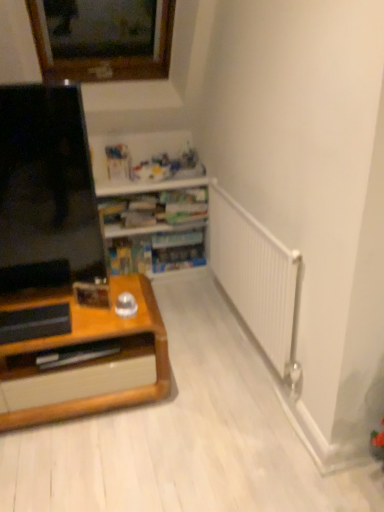
Question: From a real-world perspective, is wooden bookshelf at center positioned above or below black glossy screen at left?

Choices:
 (A) above
 (B) below

Answer: (B)

Question: In terms of size, does wooden bookshelf at center appear bigger or smaller than black glossy screen at left?

Choices:
 (A) big
 (B) small

Answer: (A)

Question: Choose the correct answer: Is wooden bookshelf at center inside black glossy screen at left or outside it?

Choices:
 (A) inside
 (B) outside

Answer: (B)

Question: From a real-world perspective, relative to wooden bookshelf at center, is black glossy screen at left vertically above or below?

Choices:
 (A) above
 (B) below

Answer: (A)

Question: Considering the positions of black glossy screen at left and wooden bookshelf at center in the image, is black glossy screen at left wider or thinner than wooden bookshelf at center?

Choices:
 (A) wide
 (B) thin

Answer: (B)

Question: In the image, is black glossy screen at left positioned in front of or behind wooden bookshelf at center?

Choices:
 (A) behind
 (B) front

Answer: (B)

Question: From their relative heights in the image, would you say black glossy screen at left is taller or shorter than wooden bookshelf at center?

Choices:
 (A) short
 (B) tall

Answer: (B)